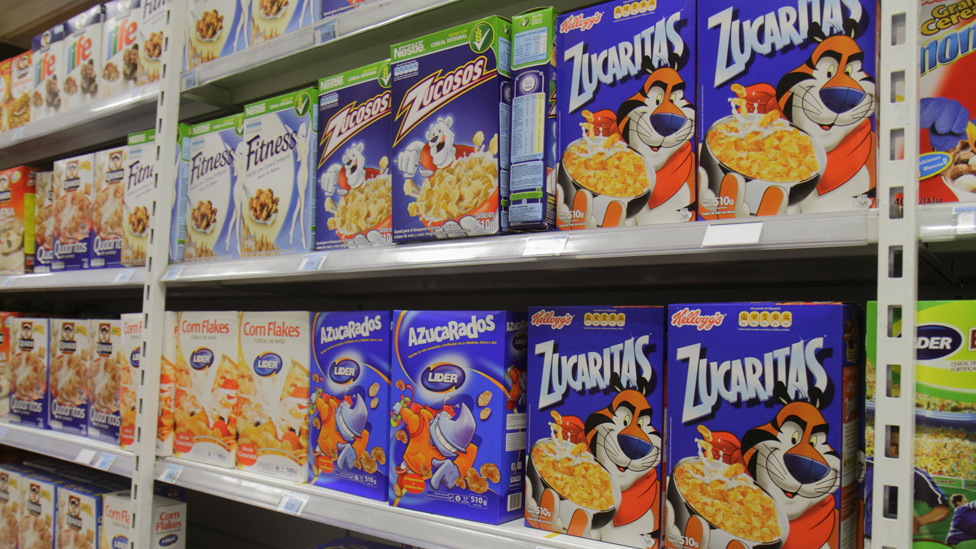
In order to click on shelves in this screenshot , I will do `click(303, 30)`, `click(355, 257)`, `click(57, 447)`, `click(59, 276)`, `click(74, 109)`, `click(953, 229)`.